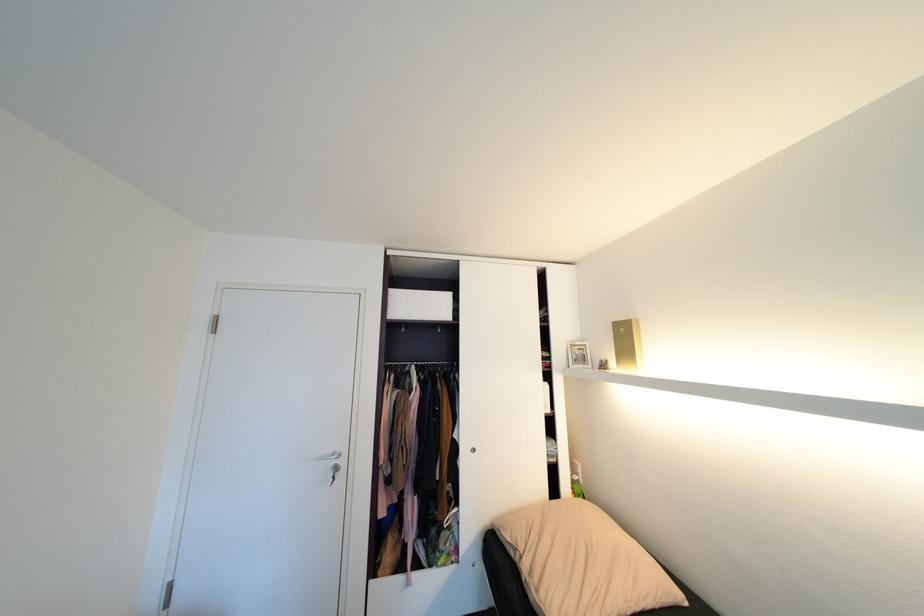
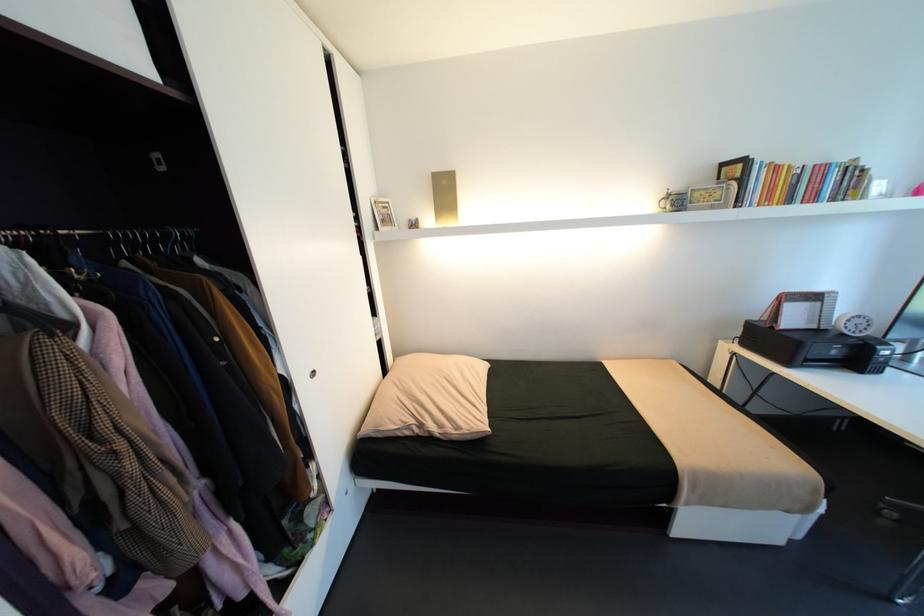
Where in the second image is the point corresponding to (x=518, y=554) from the first image?

(415, 432)